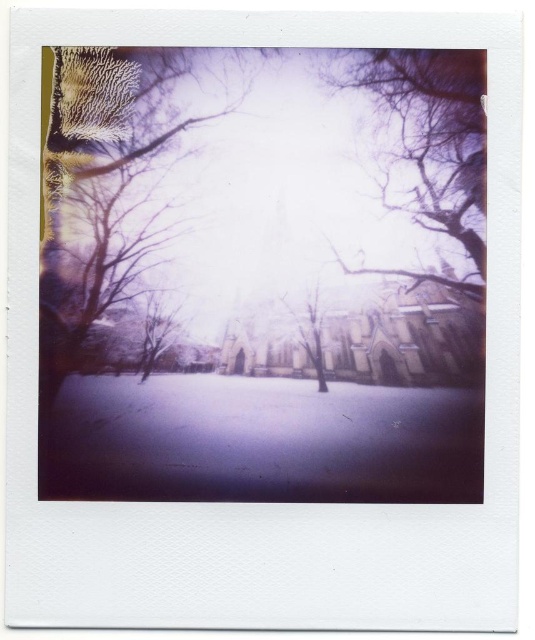
Describe the element at coordinates (435, 129) in the screenshot. The height and width of the screenshot is (640, 535). I see `translucent purple branches at upper right` at that location.

Can you confirm if translucent purple branches at upper right is taller than smooth brown tree at center?

Correct, translucent purple branches at upper right is much taller as smooth brown tree at center.

Between point (447, 198) and point (322, 388), which one is positioned behind?

The point (322, 388) is behind.

Locate an element on the screen. The width and height of the screenshot is (535, 640). translucent purple branches at upper right is located at coordinates (435, 129).

Does smooth bark tree at left come in front of smooth brown tree at center?

Yes, smooth bark tree at left is closer to the viewer.

Can you confirm if smooth bark tree at left is positioned above smooth brown tree at center?

Indeed, smooth bark tree at left is positioned over smooth brown tree at center.

The width and height of the screenshot is (535, 640). Describe the element at coordinates (104, 195) in the screenshot. I see `smooth bark tree at left` at that location.

Identify the location of smooth bark tree at left. pyautogui.click(x=104, y=195).

Does smooth bark tree at left appear over translucent purple branches at upper right?

No, smooth bark tree at left is not above translucent purple branches at upper right.

Can you confirm if smooth bark tree at left is positioned to the right of translucent purple branches at upper right?

No, smooth bark tree at left is not to the right of translucent purple branches at upper right.

Between point (54, 92) and point (434, 77), which one is positioned in front?

Point (54, 92)

You are a GUI agent. You are given a task and a screenshot of the screen. Output one action in this format:
    pyautogui.click(x=<x>, y=<y>)
    Task: Click on the smooth bark tree at left
    The height and width of the screenshot is (640, 535).
    Given the screenshot: What is the action you would take?
    pyautogui.click(x=104, y=195)